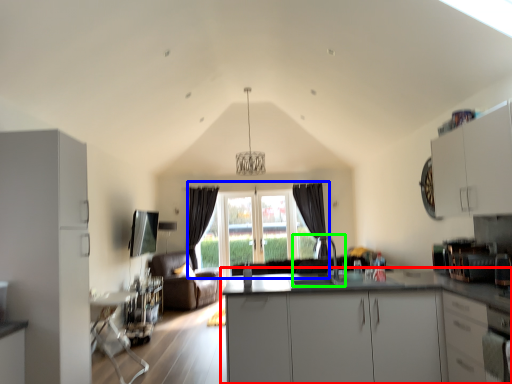
Question: Based on their relative distances, which object is farther from countertop (highlighted by a red box)? Choose from window (highlighted by a blue box) and sink (highlighted by a green box).

Choices:
 (A) window
 (B) sink

Answer: (A)